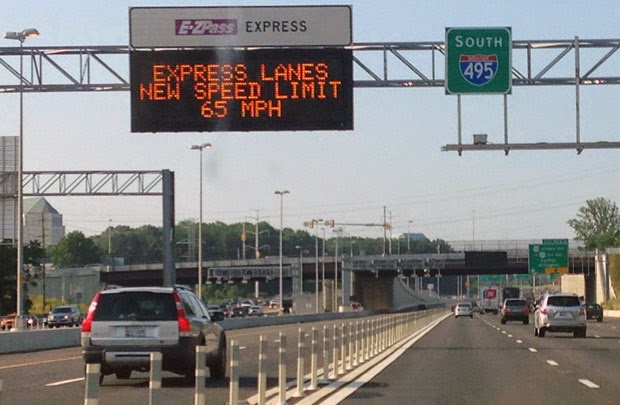
Identify the location of glass. The width and height of the screenshot is (620, 405). (193, 307).